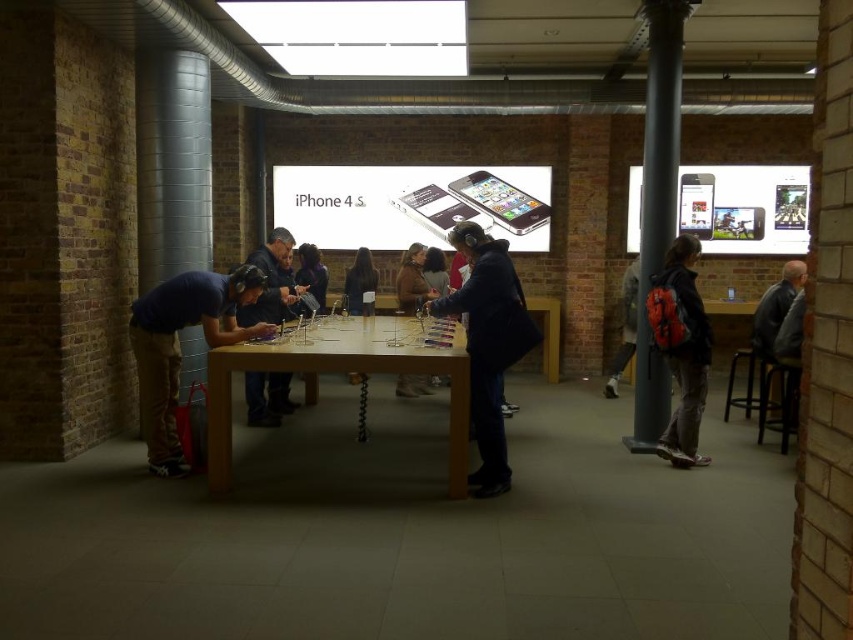
Question: Among these points, which one is nearest to the camera?

Choices:
 (A) (351, 285)
 (B) (490, 472)

Answer: (B)

Question: Is black plastic stool at lower right below brown wooden stool at lower right?

Choices:
 (A) yes
 (B) no

Answer: (A)

Question: Which object appears closest to the camera in this image?

Choices:
 (A) brown wooden stool at lower right
 (B) brown leather jacket at center
 (C) dark blue jacket at center
 (D) metallic gray column at left

Answer: (C)

Question: Does gray concrete pillar at right appear over purple fabric bag at center?

Choices:
 (A) no
 (B) yes

Answer: (B)

Question: Is wooden table at center to the right of leather jacket at right from the viewer's perspective?

Choices:
 (A) yes
 (B) no

Answer: (B)

Question: Which point is closer to the camera taking this photo?

Choices:
 (A) (148, 436)
 (B) (407, 394)

Answer: (A)